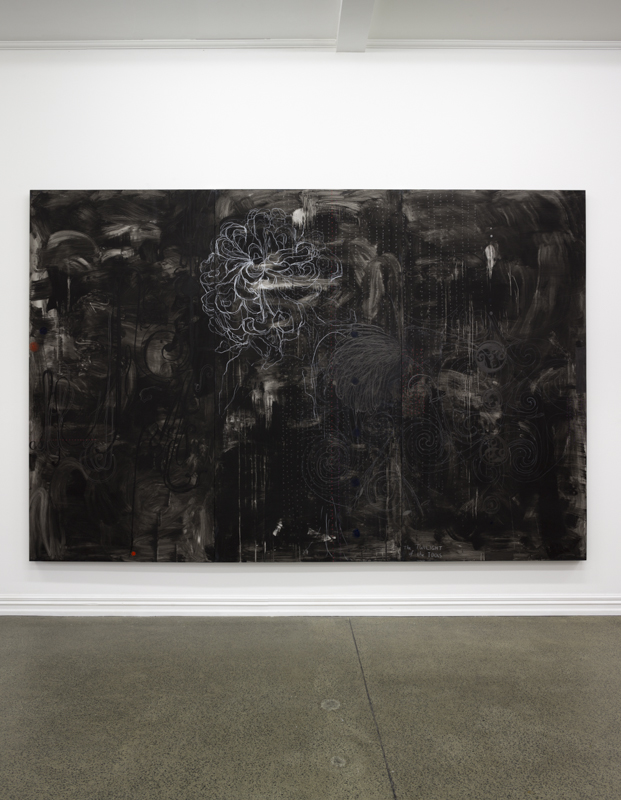
You are a GUI agent. You are given a task and a screenshot of the screen. Output one action in this format:
    pyautogui.click(x=<x>, y=<y>)
    Task: Click on the seam in floor
    The image size is (621, 800).
    Given the screenshot: What is the action you would take?
    pyautogui.click(x=350, y=622), pyautogui.click(x=396, y=796)